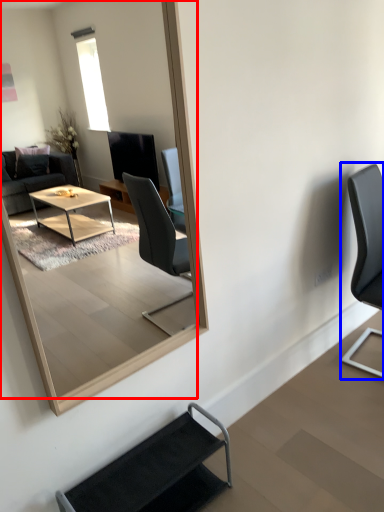
Question: Which object is closer to the camera taking this photo, mirror (highlighted by a red box) or chair (highlighted by a blue box)?

Choices:
 (A) mirror
 (B) chair

Answer: (A)